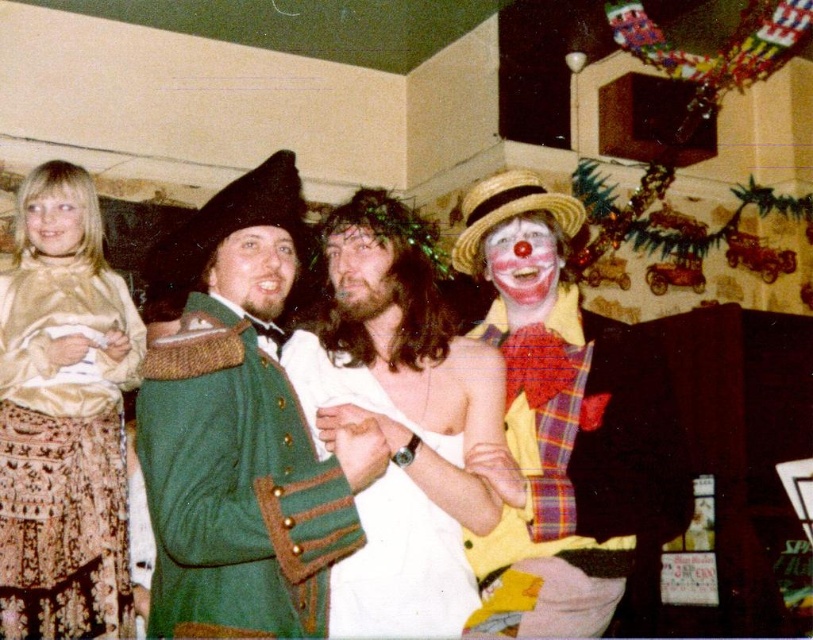
Which is above, matte green vest at center or blonde hair at left?

Positioned higher is blonde hair at left.

Between matte green vest at center and blonde hair at left, which one is positioned lower?

matte green vest at center is lower down.

Who is more forward, (254, 305) or (33, 236)?

Point (254, 305) is more forward.

Identify the location of matte green vest at center. This screenshot has width=813, height=640. (254, 269).

Is the position of gold satin blouse at left more distant than that of matte clown face at center?

Yes, gold satin blouse at left is further from the viewer.

Who is shorter, gold satin blouse at left or matte clown face at center?

Standing shorter between the two is matte clown face at center.

Is point (90, 477) positioned after point (540, 230)?

Yes.

Locate an element on the screen. gold satin blouse at left is located at coordinates (63, 417).

Can you confirm if matte clown face at center is positioned above shaggy brown hair at center?

Indeed, matte clown face at center is positioned over shaggy brown hair at center.

This screenshot has width=813, height=640. In order to click on matte clown face at center in this screenshot , I will do `click(522, 262)`.

The width and height of the screenshot is (813, 640). I want to click on matte clown face at center, so click(522, 262).